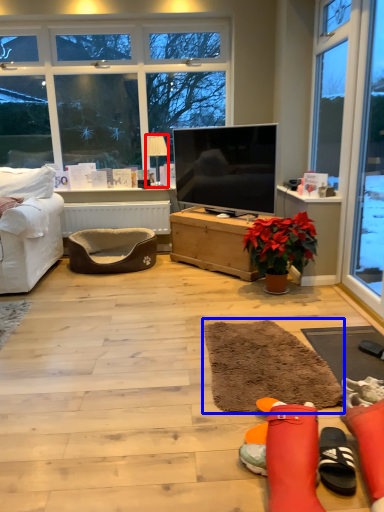
Question: Which object is further to the camera taking this photo, lamp (highlighted by a red box) or flat (highlighted by a blue box)?

Choices:
 (A) lamp
 (B) flat

Answer: (A)